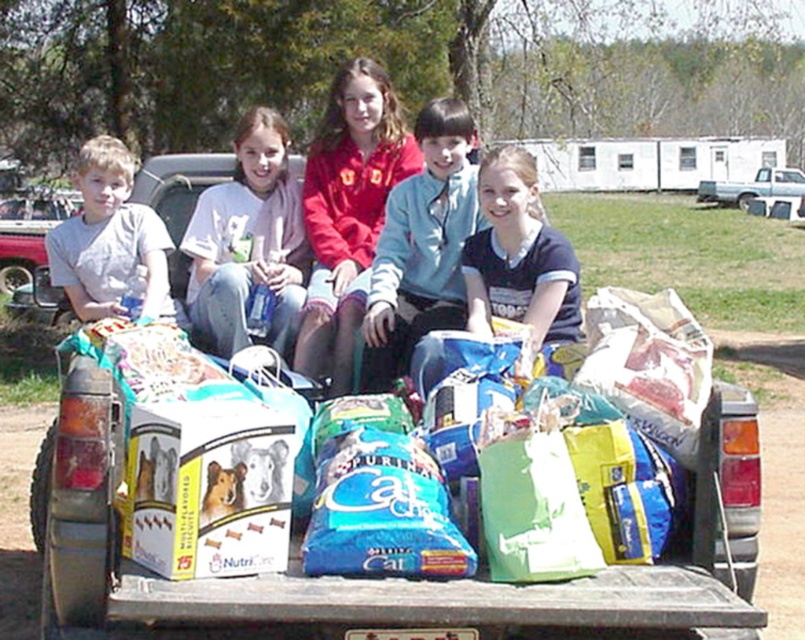
Is matte plastic bottle at center to the right of red fleece jacket at center from the viewer's perspective?

In fact, matte plastic bottle at center is to the left of red fleece jacket at center.

Between matte plastic bottle at center and red fleece jacket at center, which one has more height?

With more height is matte plastic bottle at center.

Consider the image. Who is more forward, (459, 188) or (356, 156)?

Point (459, 188) is more forward.

Where is `matte plastic bottle at center`? This screenshot has height=640, width=805. matte plastic bottle at center is located at coordinates point(382,227).

Consider the image. Can you confirm if white cotton shirt at center is positioned above dark blue t-shirt at center?

Indeed, white cotton shirt at center is positioned over dark blue t-shirt at center.

Does point (269, 145) lie in front of point (498, 284)?

No, it is not.

Find the location of `white cotton shirt at center`. white cotton shirt at center is located at coordinates [248, 243].

Does red fleece jacket at center appear on the right side of matte gray shirt at left?

Yes, red fleece jacket at center is to the right of matte gray shirt at left.

Does red fleece jacket at center lie behind matte gray shirt at left?

No, red fleece jacket at center is closer to the viewer.

Which is behind, point (337, 225) or point (114, 260)?

The point (337, 225) is more distant.

Locate an element on the screen. red fleece jacket at center is located at coordinates (347, 212).